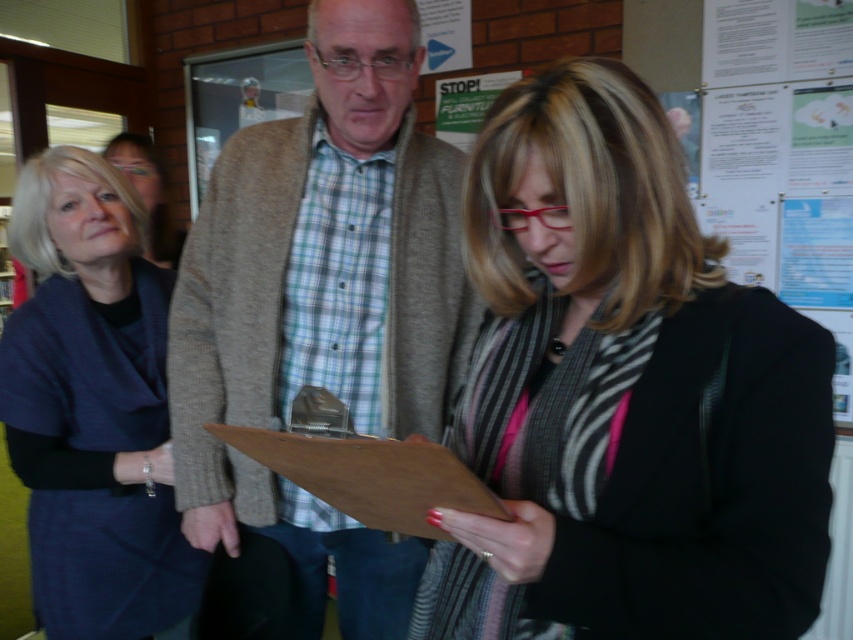
From the picture: You are an observer in the scene. You notice two clothing items, the gray wool sweater at center and the dark blue fabric dress at left. Which clothing item is covering part of the other?

The gray wool sweater at center is positioned over the dark blue fabric dress at left, so the gray wool sweater at center is covering part of the dark blue fabric dress at left.